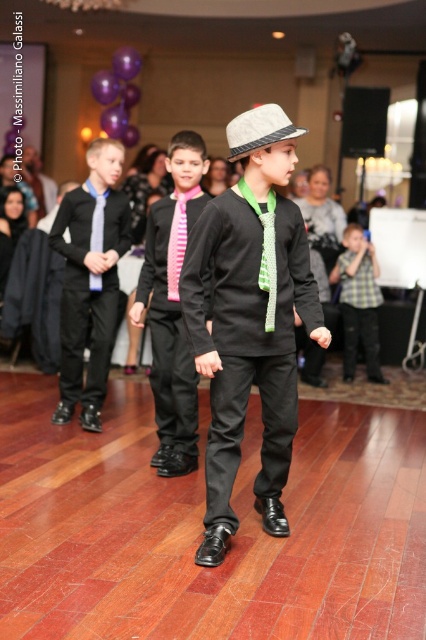
Question: Is matte black suit at center below felt fedora at center?

Choices:
 (A) yes
 (B) no

Answer: (A)

Question: Can you confirm if checkered fabric shirt at right is positioned above matte pink tie at center?

Choices:
 (A) no
 (B) yes

Answer: (A)

Question: Which object appears closest to the camera in this image?

Choices:
 (A) black satin suit at center
 (B) matte black suit at center
 (C) felt fedora at center
 (D) matte pink tie at center

Answer: (C)

Question: Is checkered fabric shirt at right thinner than matte pink tie at center?

Choices:
 (A) yes
 (B) no

Answer: (B)

Question: Which object appears closest to the camera in this image?

Choices:
 (A) matte black suit at center
 (B) felt fedora at center
 (C) matte black shirt at center

Answer: (B)

Question: Which of the following is the farthest from the observer?

Choices:
 (A) matte pink tie at center
 (B) matte black shirt at center
 (C) black satin suit at center
 (D) felt fedora at center

Answer: (A)